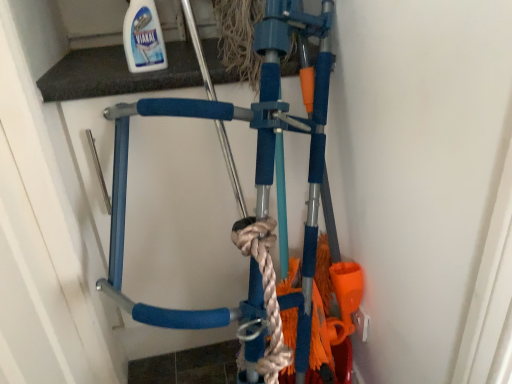
Locate an element on the screen. free point behind white glossy bottle at upper center is located at coordinates (166, 57).